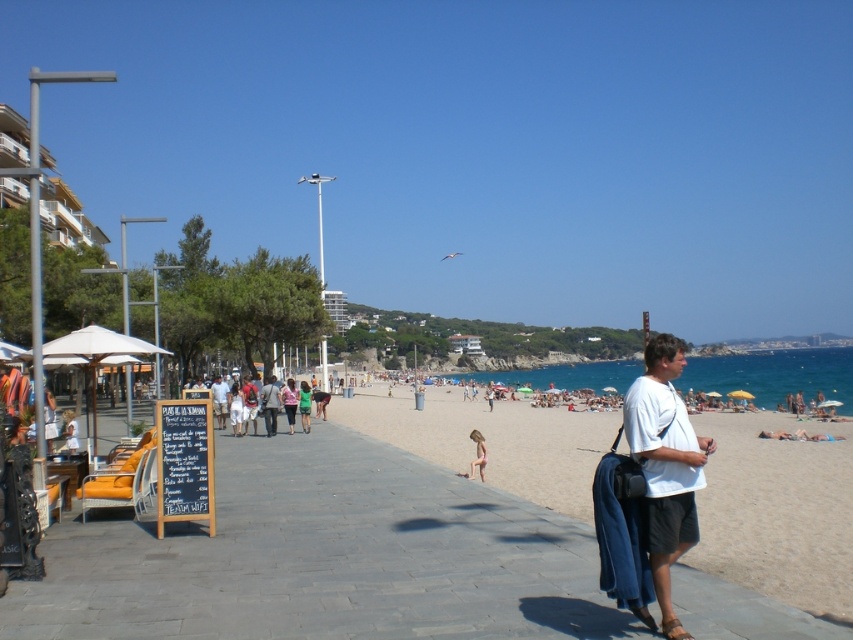
Question: Can you confirm if beige sand at beach center is positioned below pink fabric bikini at lower center?

Choices:
 (A) yes
 (B) no

Answer: (A)

Question: Does white cotton shirt at center-right have a lesser width compared to pink fabric bikini at lower center?

Choices:
 (A) yes
 (B) no

Answer: (B)

Question: Among these points, which one is farthest from the camera?

Choices:
 (A) (659, 429)
 (B) (469, 477)
 (C) (804, 566)

Answer: (B)

Question: Is beige sand at beach center thinner than pink fabric bikini at lower center?

Choices:
 (A) yes
 (B) no

Answer: (B)

Question: Which object is positioned closest to the white cotton shirt at center-right?

Choices:
 (A) beige sand at beach center
 (B) pink fabric bikini at lower center

Answer: (B)

Question: Based on their relative distances, which object is farther from the pink fabric bikini at lower center?

Choices:
 (A) white cotton shirt at center-right
 (B) beige sand at beach center

Answer: (B)